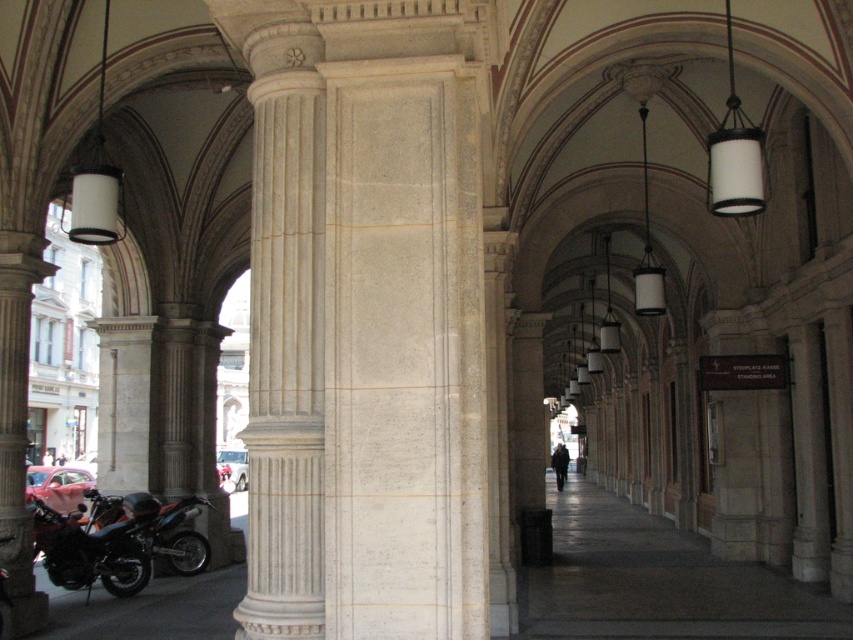
Who is lower down, orange metallic motorcycle at lower left or shiny metallic motorcycle at lower left?

orange metallic motorcycle at lower left is lower down.

Which of these two, orange metallic motorcycle at lower left or shiny metallic motorcycle at lower left, stands taller?

With more height is shiny metallic motorcycle at lower left.

Between point (61, 579) and point (120, 513), which one is positioned behind?

The point (120, 513) is more distant.

Find the location of a particular element. The width and height of the screenshot is (853, 640). orange metallic motorcycle at lower left is located at coordinates (90, 552).